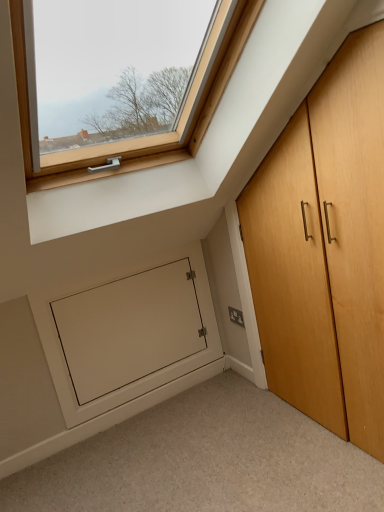
Question: Considering the relative sizes of light brown wood cupboard at right and white matte door at lower left in the image provided, is light brown wood cupboard at right smaller than white matte door at lower left?

Choices:
 (A) yes
 (B) no

Answer: (B)

Question: From a real-world perspective, is light brown wood cupboard at right below white matte door at lower left?

Choices:
 (A) no
 (B) yes

Answer: (A)

Question: Is light brown wood cupboard at right at the right side of white matte door at lower left?

Choices:
 (A) yes
 (B) no

Answer: (A)

Question: Is light brown wood cupboard at right outside of white matte door at lower left?

Choices:
 (A) no
 (B) yes

Answer: (B)

Question: Considering the relative sizes of light brown wood cupboard at right and white matte door at lower left in the image provided, is light brown wood cupboard at right shorter than white matte door at lower left?

Choices:
 (A) yes
 (B) no

Answer: (B)

Question: Is light brown wood cupboard at right looking in the opposite direction of white matte door at lower left?

Choices:
 (A) yes
 (B) no

Answer: (B)

Question: Can light brown wood cupboard at right be found inside white matte door at lower left?

Choices:
 (A) yes
 (B) no

Answer: (B)

Question: Would you consider white matte door at lower left to be distant from light brown wood cupboard at right?

Choices:
 (A) no
 (B) yes

Answer: (A)

Question: From a real-world perspective, is white matte door at lower left located beneath light brown wood cupboard at right?

Choices:
 (A) no
 (B) yes

Answer: (B)

Question: Can you confirm if white matte door at lower left is thinner than light brown wood cupboard at right?

Choices:
 (A) yes
 (B) no

Answer: (B)

Question: Is white matte door at lower left bigger than light brown wood cupboard at right?

Choices:
 (A) no
 (B) yes

Answer: (A)

Question: Considering the relative sizes of white matte door at lower left and light brown wood cupboard at right in the image provided, is white matte door at lower left taller than light brown wood cupboard at right?

Choices:
 (A) no
 (B) yes

Answer: (A)

Question: Is satin silver plate at lower right at the back of light brown wood cupboard at right?

Choices:
 (A) yes
 (B) no

Answer: (B)